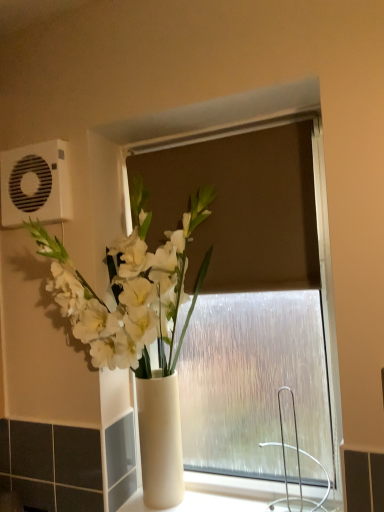
Describe the element at coordinates (130, 289) in the screenshot. I see `white glossy vase at center` at that location.

Identify the location of white glossy vase at center. (130, 289).

The image size is (384, 512). Describe the element at coordinates (36, 184) in the screenshot. I see `white plastic air conditioning unit at upper left` at that location.

Where is `white plastic air conditioning unit at upper left`? Image resolution: width=384 pixels, height=512 pixels. white plastic air conditioning unit at upper left is located at coordinates (36, 184).

Identify the location of white glossy vase at center. (130, 289).

Considering the relative positions of white plastic air conditioning unit at upper left and white glossy vase at center in the image provided, is white plastic air conditioning unit at upper left to the right of white glossy vase at center from the viewer's perspective?

Incorrect, white plastic air conditioning unit at upper left is not on the right side of white glossy vase at center.

Looking at this image, between white plastic air conditioning unit at upper left and white glossy vase at center, which one is positioned behind?

white plastic air conditioning unit at upper left.

Considering the positions of point (24, 210) and point (169, 260), is point (24, 210) closer or farther from the camera than point (169, 260)?

Point (24, 210) is positioned farther from the camera compared to point (169, 260).

From the image's perspective, who appears lower, white plastic air conditioning unit at upper left or white glossy vase at center?

white glossy vase at center.

From a real-world perspective, does white plastic air conditioning unit at upper left sit lower than white glossy vase at center?

No.

Looking at their sizes, would you say white plastic air conditioning unit at upper left is wider or thinner than white glossy vase at center?

Considering their sizes, white plastic air conditioning unit at upper left looks slimmer than white glossy vase at center.

Can you confirm if white plastic air conditioning unit at upper left is shorter than white glossy vase at center?

Yes, white plastic air conditioning unit at upper left is shorter than white glossy vase at center.

Between white plastic air conditioning unit at upper left and white glossy vase at center, which one has larger size?

white glossy vase at center is bigger.

Is white plastic air conditioning unit at upper left completely or partially outside of white glossy vase at center?

Yes.

Is white plastic air conditioning unit at upper left with white glossy vase at center?

white plastic air conditioning unit at upper left and white glossy vase at center are not in contact.

Consider the image. Could you tell me if white plastic air conditioning unit at upper left is facing white glossy vase at center?

No, white plastic air conditioning unit at upper left is not facing towards white glossy vase at center.

What's the angular difference between white plastic air conditioning unit at upper left and white glossy vase at center's facing directions?

0.00345 degrees separate the facing orientations of white plastic air conditioning unit at upper left and white glossy vase at center.

Image resolution: width=384 pixels, height=512 pixels. Find the location of `air conditioning above the white glossy vase at center (from a real-world perspective)`. air conditioning above the white glossy vase at center (from a real-world perspective) is located at coordinates (36, 184).

Considering the relative positions of white glossy vase at center and white plastic air conditioning unit at upper left in the image provided, is white glossy vase at center to the left or to the right of white plastic air conditioning unit at upper left?

Based on their positions, white glossy vase at center is located to the right of white plastic air conditioning unit at upper left.

Is white glossy vase at center further to camera compared to white plastic air conditioning unit at upper left?

No, white glossy vase at center is closer to the camera.

Is point (169, 367) positioned before point (26, 178)?

Yes.

From the image's perspective, which one is positioned higher, white glossy vase at center or white plastic air conditioning unit at upper left?

white plastic air conditioning unit at upper left.

From a real-world perspective, is white glossy vase at center positioned under white plastic air conditioning unit at upper left based on gravity?

Yes, from a real-world perspective, white glossy vase at center is below white plastic air conditioning unit at upper left.

Does white glossy vase at center have a lesser width compared to white plastic air conditioning unit at upper left?

No.

Looking at this image, which of these two, white glossy vase at center or white plastic air conditioning unit at upper left, stands taller?

white glossy vase at center.

Looking at the image, does white glossy vase at center seem bigger or smaller compared to white plastic air conditioning unit at upper left?

In the image, white glossy vase at center appears to be larger than white plastic air conditioning unit at upper left.

Choose the correct answer: Is white glossy vase at center inside white plastic air conditioning unit at upper left or outside it?

The correct answer is: outside.

Is white glossy vase at center beside white plastic air conditioning unit at upper left?

No, white glossy vase at center is not beside white plastic air conditioning unit at upper left.

Could you tell me if white glossy vase at center is facing white plastic air conditioning unit at upper left?

No, white glossy vase at center is not turned towards white plastic air conditioning unit at upper left.

How many degrees apart are the facing directions of white glossy vase at center and white plastic air conditioning unit at upper left?

0.00345 degrees.

The image size is (384, 512). In the image, there is a white plastic air conditioning unit at upper left. Identify the location of houseplant below it (from a real-world perspective). (130, 289).

This screenshot has height=512, width=384. I want to click on air conditioning located above the white glossy vase at center (from a real-world perspective), so click(x=36, y=184).

Where is `air conditioning on the left of white glossy vase at center`? The height and width of the screenshot is (512, 384). air conditioning on the left of white glossy vase at center is located at coordinates (36, 184).